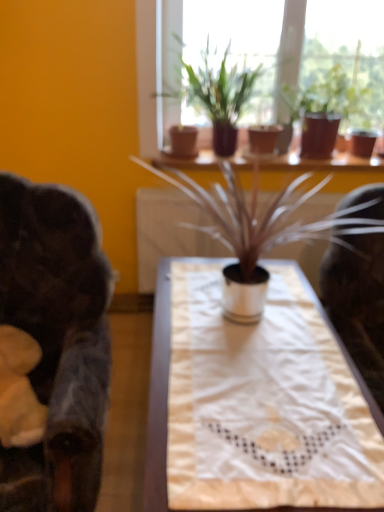
Measure the distance between matte brown pot at upper center, positioned as the second houseplant in back-to-front order, and camera.

7.11 feet.

Locate an element on the screen. white metallic pot at center, which appears as the 1th houseplant when viewed from the front is located at coordinates (227, 220).

Find the location of a particular element. dark brown leather rocking chair at left is located at coordinates (60, 325).

What do you see at coordinates (261, 57) in the screenshot? This screenshot has height=512, width=384. I see `matte brown pots at upper center` at bounding box center [261, 57].

Where is `matte brown pot at upper center, positioned as the second houseplant in back-to-front order`? This screenshot has width=384, height=512. matte brown pot at upper center, positioned as the second houseplant in back-to-front order is located at coordinates (217, 96).

Is matte brown pot at upper center, which is the 3th houseplant in front-to-back order, not near matte brown pots at upper center?

matte brown pot at upper center, which is the 3th houseplant in front-to-back order, is near matte brown pots at upper center, not far away.

Considering the relative sizes of matte brown pot at upper center, arranged as the 1th houseplant when viewed from the back, and matte brown pots at upper center in the image provided, is matte brown pot at upper center, arranged as the 1th houseplant when viewed from the back, smaller than matte brown pots at upper center?

Yes, matte brown pot at upper center, arranged as the 1th houseplant when viewed from the back, is smaller than matte brown pots at upper center.

Locate an element on the screen. houseplant that is the 2nd object directly below the matte brown pots at upper center (from a real-world perspective) is located at coordinates (x=331, y=110).

Which of these two, matte brown pots at upper center or dark brown leather rocking chair at left, stands shorter?

Standing shorter between the two is matte brown pots at upper center.

Identify the location of window behind the dark brown leather rocking chair at left. 261,57.

Does matte brown pots at upper center appear on the right side of dark brown leather rocking chair at left?

Yes.

Is point (324, 34) behind point (91, 301)?

Yes, point (324, 34) is farther from viewer.

Does matte brown pot at upper center, which is the 3th houseplant in front-to-back order, turn towards dark brown leather rocking chair at left?

No, matte brown pot at upper center, which is the 3th houseplant in front-to-back order, is not facing towards dark brown leather rocking chair at left.

In the scene shown: Does matte brown pot at upper center, arranged as the 1th houseplant when viewed from the back, have a lesser width compared to dark brown leather rocking chair at left?

Indeed, matte brown pot at upper center, arranged as the 1th houseplant when viewed from the back, has a lesser width compared to dark brown leather rocking chair at left.

Is matte brown pot at upper center, which is the 3th houseplant in front-to-back order, next to dark brown leather rocking chair at left and touching it?

They are not placed beside each other.

Considering the sizes of objects matte brown pot at upper center, arranged as the 1th houseplant when viewed from the back, and dark brown leather rocking chair at left in the image provided, who is taller, matte brown pot at upper center, arranged as the 1th houseplant when viewed from the back, or dark brown leather rocking chair at left?

With more height is dark brown leather rocking chair at left.

Which of these two, white fabric table at center or white metallic pot at center, which appears as the 1th houseplant when viewed from the front, is thinner?

white metallic pot at center, which appears as the 1th houseplant when viewed from the front.

Identify the location of table in front of the white metallic pot at center, the third houseplant from the back. (197, 406).

How many degrees apart are the facing directions of white fabric table at center and white metallic pot at center, the third houseplant from the back?

white fabric table at center and white metallic pot at center, the third houseplant from the back, are facing 0.908 degrees away from each other.

Which point is more distant from viewer, (219, 80) or (100, 232)?

Point (219, 80)

Which object is closer to the camera, matte brown pot at upper center, which is the 2th houseplant from front to back, or dark brown leather rocking chair at left?

dark brown leather rocking chair at left is in front.

Can you confirm if matte brown pot at upper center, positioned as the second houseplant in back-to-front order, is wider than dark brown leather rocking chair at left?

No.

From the dark brown leather rocking chair at left, count 2nd houseplants backward and point to it. Please provide its 2D coordinates.

[(217, 96)]

Which point is more forward, (x=45, y=446) or (x=364, y=110)?

The point (x=45, y=446) is in front.

Can you tell me how much dark brown leather rocking chair at left and matte brown pot at upper center, arranged as the 1th houseplant when viewed from the back, differ in facing direction?

There is a 5.66-degree angle between the facing directions of dark brown leather rocking chair at left and matte brown pot at upper center, arranged as the 1th houseplant when viewed from the back.

Between dark brown leather rocking chair at left and matte brown pot at upper center, which is the 3th houseplant in front-to-back order, which one has smaller width?

Thinner between the two is matte brown pot at upper center, which is the 3th houseplant in front-to-back order.

Is the depth of dark brown leather rocking chair at left greater than that of matte brown pot at upper center, which is the 3th houseplant in front-to-back order?

No, it is in front of matte brown pot at upper center, which is the 3th houseplant in front-to-back order.

From the image's perspective, is matte brown pots at upper center over white fabric table at center?

Yes, from the image's perspective, matte brown pots at upper center is on top of white fabric table at center.

Can you confirm if matte brown pots at upper center is positioned to the right of white fabric table at center?

Yes, matte brown pots at upper center is to the right of white fabric table at center.

From a real-world perspective, who is located lower, matte brown pots at upper center or white fabric table at center?

In real-world perspective, white fabric table at center is lower.

From a real-world perspective, starting from the matte brown pots at upper center, which houseplant is the 2nd one below it? Please provide its 2D coordinates.

[(331, 110)]

This screenshot has width=384, height=512. Identify the location of window above the dark brown leather rocking chair at left (from a real-world perspective). (261, 57).

Which object lies further to the anchor point white fabric table at center, matte brown pots at upper center or matte brown pot at upper center, positioned as the second houseplant in back-to-front order?

Based on the image, matte brown pots at upper center appears to be further to white fabric table at center.

Which object lies further to the anchor point white fabric table at center, dark brown leather rocking chair at left or matte brown pot at upper center, arranged as the 1th houseplant when viewed from the back?

matte brown pot at upper center, arranged as the 1th houseplant when viewed from the back.

Based on their spatial positions, is dark brown leather rocking chair at left or matte brown pot at upper center, positioned as the second houseplant in back-to-front order, closer to matte brown pot at upper center, arranged as the 1th houseplant when viewed from the back?

Based on the image, matte brown pot at upper center, positioned as the second houseplant in back-to-front order, appears to be nearer to matte brown pot at upper center, arranged as the 1th houseplant when viewed from the back.

From the image, which object appears to be nearer to matte brown pot at upper center, which is the 3th houseplant in front-to-back order, matte brown pots at upper center or white metallic pot at center, which appears as the 1th houseplant when viewed from the front?

matte brown pots at upper center.

From the image, which object appears to be nearer to matte brown pots at upper center, white fabric table at center or white metallic pot at center, the third houseplant from the back?

white metallic pot at center, the third houseplant from the back, lies closer to matte brown pots at upper center than the other object.

Considering their positions, is dark brown leather rocking chair at left positioned further to matte brown pot at upper center, which is the 2th houseplant from front to back, than matte brown pots at upper center?

dark brown leather rocking chair at left.

From the image, which object appears to be farther from matte brown pot at upper center, which is the 3th houseplant in front-to-back order, matte brown pots at upper center or dark brown leather rocking chair at left?

Based on the image, dark brown leather rocking chair at left appears to be further to matte brown pot at upper center, which is the 3th houseplant in front-to-back order.

When comparing their distances from dark brown leather rocking chair at left, does white fabric table at center or matte brown pot at upper center, which is the 2th houseplant from front to back, seem further?

matte brown pot at upper center, which is the 2th houseplant from front to back.

Image resolution: width=384 pixels, height=512 pixels. I want to click on table between dark brown leather rocking chair at left and white metallic pot at center, which appears as the 1th houseplant when viewed from the front, from left to right, so click(197, 406).

Locate an element on the screen. The height and width of the screenshot is (512, 384). houseplant positioned between white metallic pot at center, which appears as the 1th houseplant when viewed from the front, and matte brown pot at upper center, arranged as the 1th houseplant when viewed from the back, from near to far is located at coordinates (217, 96).

I want to click on table located between dark brown leather rocking chair at left and matte brown pot at upper center, arranged as the 1th houseplant when viewed from the back, in the depth direction, so click(x=197, y=406).

You are a GUI agent. You are given a task and a screenshot of the screen. Output one action in this format:
    pyautogui.click(x=<x>, y=<y>)
    Task: Click on the rocking chair between matte brown pots at upper center and white fabric table at center vertically
    
    Given the screenshot: What is the action you would take?
    pyautogui.click(x=60, y=325)